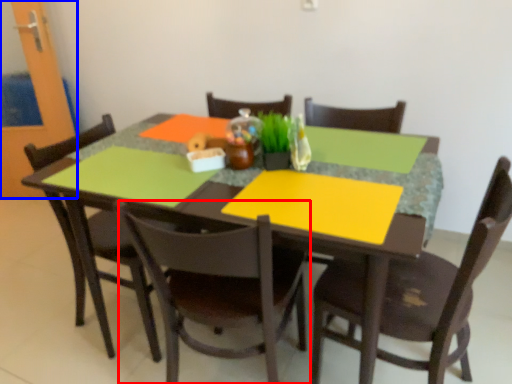
Question: Which of the following is the farthest to the observer, chair (highlighted by a red box) or glass door (highlighted by a blue box)?

Choices:
 (A) chair
 (B) glass door

Answer: (B)